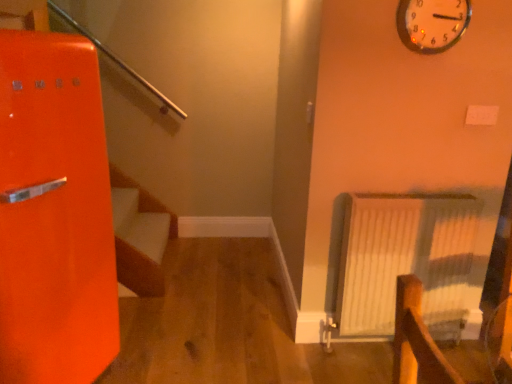
In order to face white textured radiator at right, should I rotate leftwards or rightwards?

You should rotate right by 19.586 degrees.

Describe the element at coordinates (405, 259) in the screenshot. I see `white textured radiator at right` at that location.

Locate an element on the screen. Image resolution: width=512 pixels, height=384 pixels. white textured radiator at right is located at coordinates (405, 259).

Image resolution: width=512 pixels, height=384 pixels. I want to click on metallic silver clock at upper right, so click(x=432, y=23).

Image resolution: width=512 pixels, height=384 pixels. What do you see at coordinates (432, 23) in the screenshot? I see `metallic silver clock at upper right` at bounding box center [432, 23].

What is the approximate width of metallic silver clock at upper right?

2.20 inches.

Where is `white textured radiator at right`? This screenshot has width=512, height=384. white textured radiator at right is located at coordinates (405, 259).

In the image, is metallic silver clock at upper right on the left side or the right side of white textured radiator at right?

Based on their positions, metallic silver clock at upper right is located to the right of white textured radiator at right.

Considering their positions, is metallic silver clock at upper right located in front of or behind white textured radiator at right?

metallic silver clock at upper right is in front of white textured radiator at right.

Does point (400, 12) come closer to viewer compared to point (391, 294)?

Yes, it is in front of point (391, 294).

From the image's perspective, is metallic silver clock at upper right positioned above or below white textured radiator at right?

Clearly, from the image's perspective, metallic silver clock at upper right is above white textured radiator at right.

From a real-world perspective, which object rests below the other?

white textured radiator at right is physically lower.

Between metallic silver clock at upper right and white textured radiator at right, which one has larger width?

white textured radiator at right.

From their relative heights in the image, would you say metallic silver clock at upper right is taller or shorter than white textured radiator at right?

In the image, metallic silver clock at upper right appears to be shorter than white textured radiator at right.

Can you confirm if metallic silver clock at upper right is smaller than white textured radiator at right?

Indeed, metallic silver clock at upper right has a smaller size compared to white textured radiator at right.

Would you say metallic silver clock at upper right is inside or outside white textured radiator at right?

metallic silver clock at upper right is located beyond the bounds of white textured radiator at right.

Is metallic silver clock at upper right positioned far away from white textured radiator at right?

metallic silver clock at upper right is actually quite close to white textured radiator at right.

Is metallic silver clock at upper right positioned with its back to white textured radiator at right?

No, metallic silver clock at upper right is not facing the opposite direction of white textured radiator at right.

Identify the location of wall clock lying in front of the white textured radiator at right. (432, 23).

Based on their positions, is white textured radiator at right located to the left or right of metallic silver clock at upper right?

From the image, it's evident that white textured radiator at right is to the left of metallic silver clock at upper right.

Relative to metallic silver clock at upper right, is white textured radiator at right in front or behind?

white textured radiator at right is behind metallic silver clock at upper right.

Does point (341, 261) lie in front of point (402, 4)?

No, it is behind (402, 4).

From the image's perspective, between white textured radiator at right and metallic silver clock at upper right, which one is located above?

metallic silver clock at upper right is shown above in the image.

Looking at this image, from a real-world perspective, is white textured radiator at right under metallic silver clock at upper right?

Correct, in the physical world, white textured radiator at right is lower than metallic silver clock at upper right.

Considering the relative sizes of white textured radiator at right and metallic silver clock at upper right in the image provided, is white textured radiator at right wider than metallic silver clock at upper right?

Yes.

Which of these two, white textured radiator at right or metallic silver clock at upper right, stands shorter?

metallic silver clock at upper right is shorter.

Looking at this image, who is smaller, white textured radiator at right or metallic silver clock at upper right?

With smaller size is metallic silver clock at upper right.

Is metallic silver clock at upper right inside white textured radiator at right?

No, metallic silver clock at upper right is not inside white textured radiator at right.

Are white textured radiator at right and metallic silver clock at upper right making contact?

white textured radiator at right and metallic silver clock at upper right are not in contact.

Is white textured radiator at right turned away from metallic silver clock at upper right?

No, white textured radiator at right is not facing away from metallic silver clock at upper right.

Can you tell me how much white textured radiator at right and metallic silver clock at upper right differ in facing direction?

They differ by 0.361 degrees in their facing directions.

How distant is white textured radiator at right from metallic silver clock at upper right?

The distance of white textured radiator at right from metallic silver clock at upper right is 35.54 inches.

Locate an element on the screen. wall clock that is on the right side of white textured radiator at right is located at coordinates (432, 23).

Where is `wall clock on the right of white textured radiator at right`? The width and height of the screenshot is (512, 384). wall clock on the right of white textured radiator at right is located at coordinates (432, 23).

Where is `radiator lying on the left of metallic silver clock at upper right`? This screenshot has height=384, width=512. radiator lying on the left of metallic silver clock at upper right is located at coordinates (405, 259).